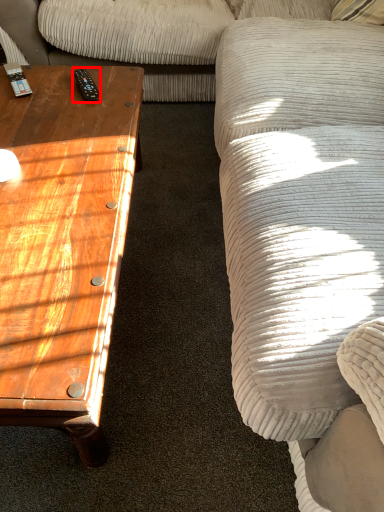
Question: From the image's perspective, considering the relative positions of remote (annotated by the red box) and coffee table in the image provided, where is remote (annotated by the red box) located with respect to the staircase?

Choices:
 (A) above
 (B) below

Answer: (A)